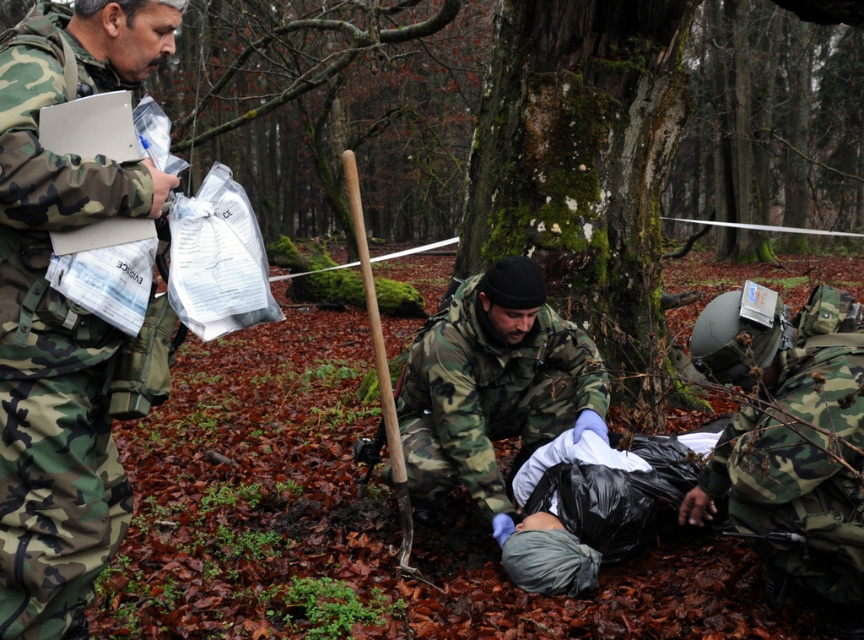
Question: Which of these objects is positioned farthest from the camouflage uniform at left?

Choices:
 (A) camo uniform at lower right
 (B) camouflage uniform at center
 (C) wooden shovel at center

Answer: (A)

Question: Which point appears farthest from the camera in this image?

Choices:
 (A) (x=849, y=609)
 (B) (x=48, y=29)
 (C) (x=540, y=353)
 (D) (x=391, y=438)

Answer: (C)

Question: Which point appears closest to the camera in this image?

Choices:
 (A) click(x=21, y=403)
 (B) click(x=837, y=406)

Answer: (A)

Question: Where is camouflage uniform at left located in relation to wooden shovel at center in the image?

Choices:
 (A) above
 (B) below

Answer: (A)

Question: Does camo uniform at lower right appear on the right side of wooden shovel at center?

Choices:
 (A) yes
 (B) no

Answer: (A)

Question: Is camo uniform at lower right below wooden shovel at center?

Choices:
 (A) no
 (B) yes

Answer: (B)